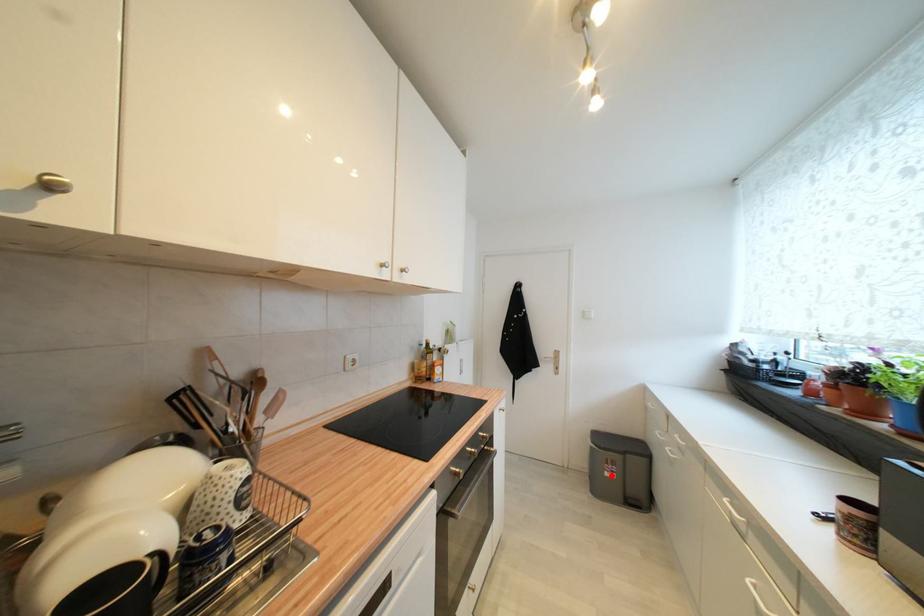
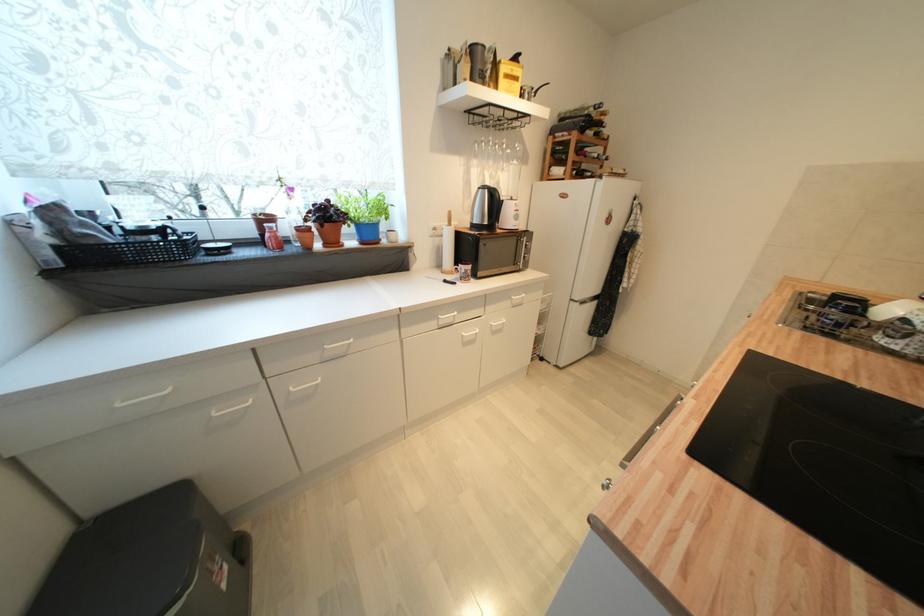
Question: I am providing you with two images of the same scene from different viewpoints. Given a red point in image1, look at the same physical point in image2. Is it:

Choices:
 (A) Closer to the viewpoint
 (B) Farther from the viewpoint

Answer: (B)